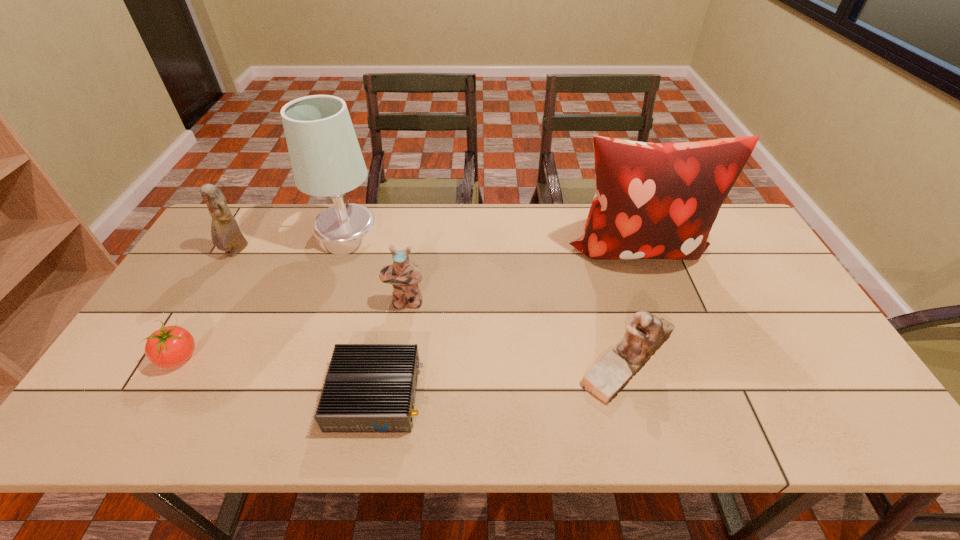
Locate an element on the screen. This screenshot has width=960, height=540. lampshade is located at coordinates (326, 159).

Locate an element on the screen. This screenshot has width=960, height=540. cushion is located at coordinates (653, 201).

The image size is (960, 540). In order to click on the fifth shortest object in this screenshot , I will do `click(226, 235)`.

This screenshot has height=540, width=960. What are the coordinates of `the tallest figurine` in the screenshot? It's located at (226, 235).

Where is `the fourth nearest object`? the fourth nearest object is located at coordinates (404, 275).

At what (x,y) coordinates should I click in order to perform the action: click on the second shortest figurine. Please return your answer as a coordinate pair (x, y). The height and width of the screenshot is (540, 960). Looking at the image, I should click on (404, 275).

The width and height of the screenshot is (960, 540). I want to click on the rightmost figurine, so tap(645, 333).

Locate an element on the screen. This screenshot has height=540, width=960. the fifth tallest object is located at coordinates (645, 333).

Locate an element on the screen. This screenshot has height=540, width=960. tomato is located at coordinates (170, 346).

Where is `router`? This screenshot has height=540, width=960. router is located at coordinates (369, 388).